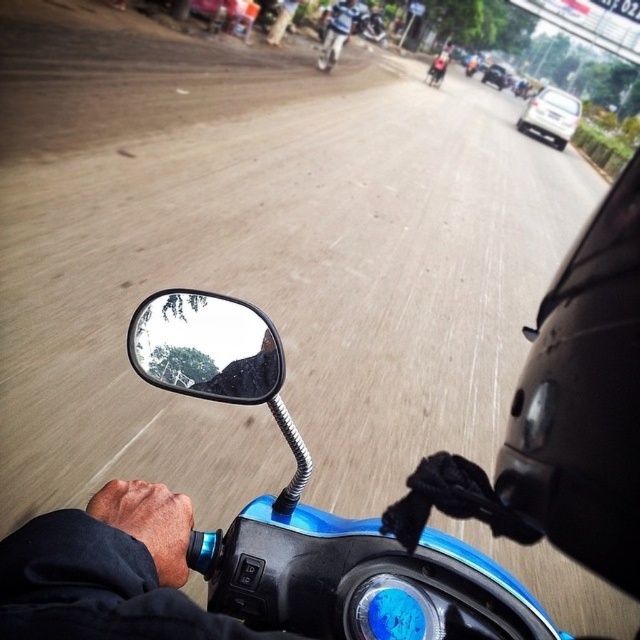
Who is taller, black matte helmet at right or blue glossy helmet at upper center?

Standing taller between the two is black matte helmet at right.

Does black matte helmet at right lie behind blue glossy helmet at upper center?

No, it is in front of blue glossy helmet at upper center.

Who is more distant from viewer, (x=636, y=449) or (x=340, y=20)?

The point (x=340, y=20) is more distant.

Identify the location of black matte helmet at right. The image size is (640, 640). (584, 400).

Between glossy plastic side mirror at lower left and blue glossy helmet at upper center, which one appears on the left side from the viewer's perspective?

Positioned to the left is glossy plastic side mirror at lower left.

Between point (202, 394) and point (348, 24), which one is positioned in front?

Point (202, 394) is in front.

Locate an element on the screen. The height and width of the screenshot is (640, 640). glossy plastic side mirror at lower left is located at coordinates (205, 346).

Can you confirm if black matte helmet at right is bigger than glossy plastic side mirror at lower left?

Yes.

I want to click on black matte helmet at right, so click(x=584, y=400).

The height and width of the screenshot is (640, 640). I want to click on black matte helmet at right, so click(x=584, y=400).